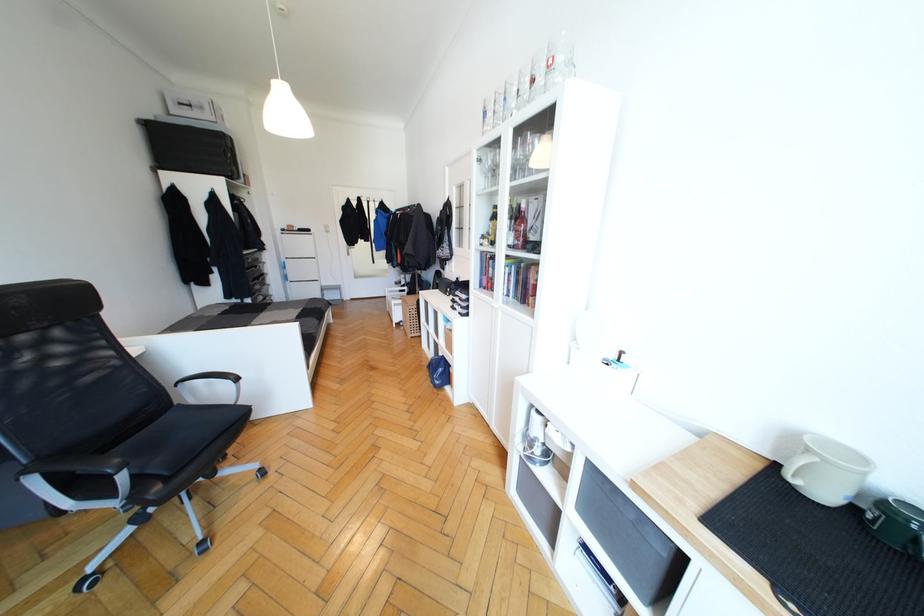
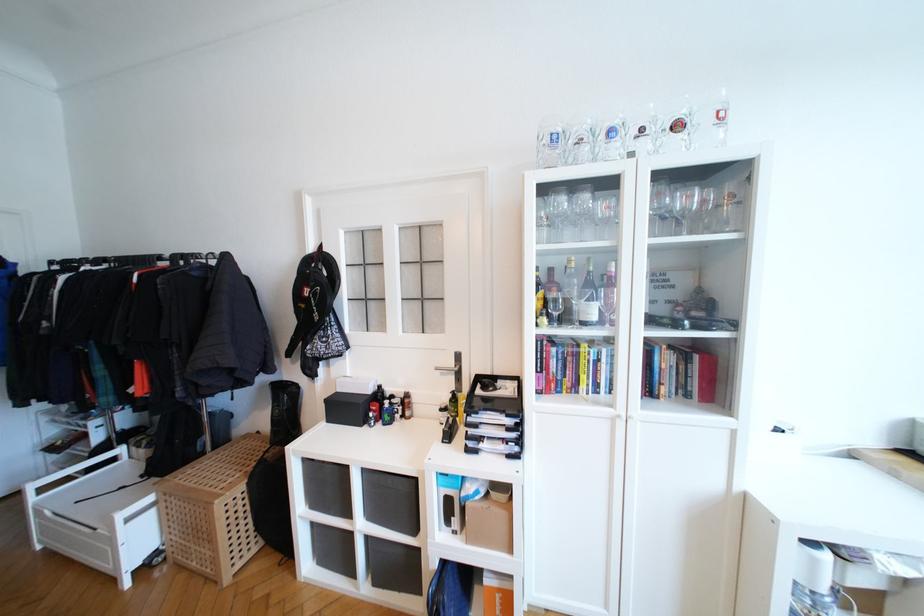
In the second image, find the point that corresponds to pixel 407 292 in the first image.

(116, 461)